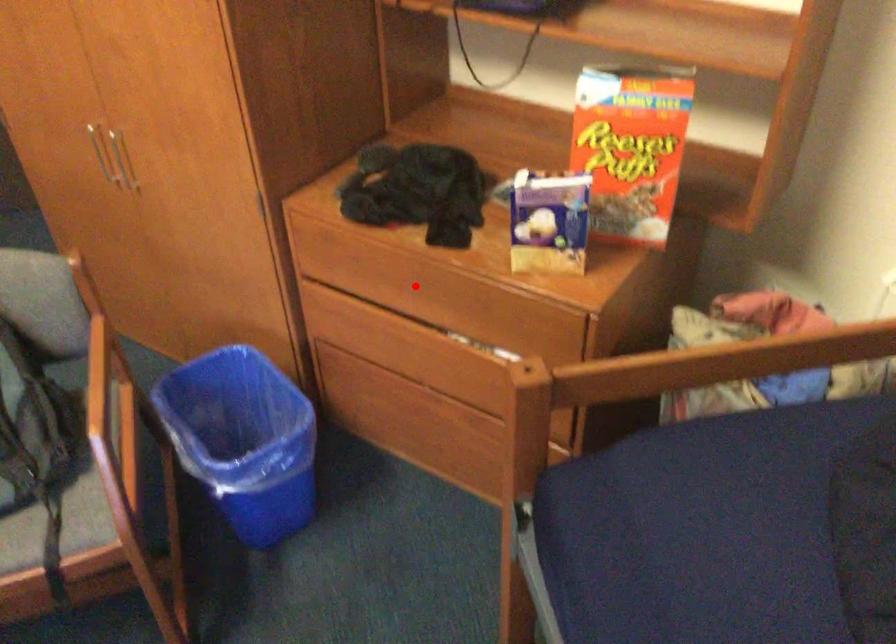
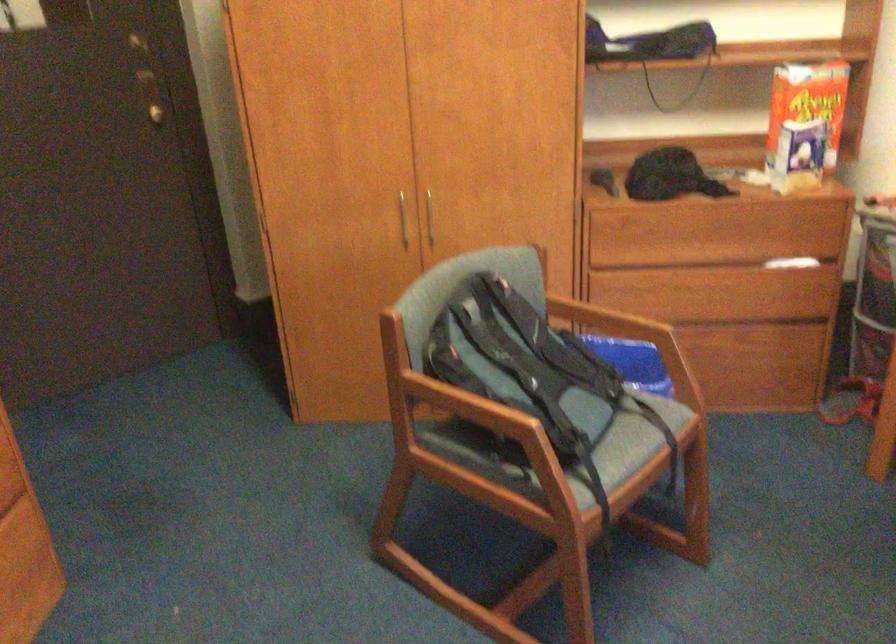
Locate, in the second image, the point that corresponds to the highlighted location in the first image.

(702, 232)